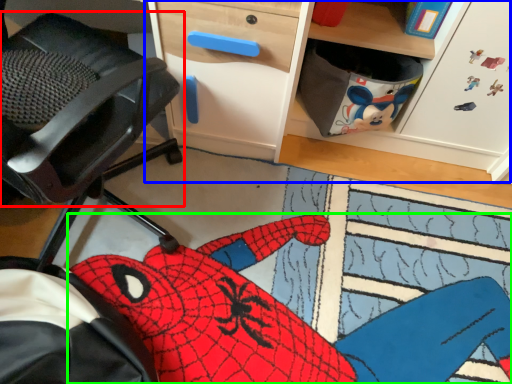
Question: Estimate the real-world distances between objects in this image. Which object is farther from chair (highlighted by a red box), computer desk (highlighted by a blue box) or animal (highlighted by a green box)?

Choices:
 (A) computer desk
 (B) animal

Answer: (B)